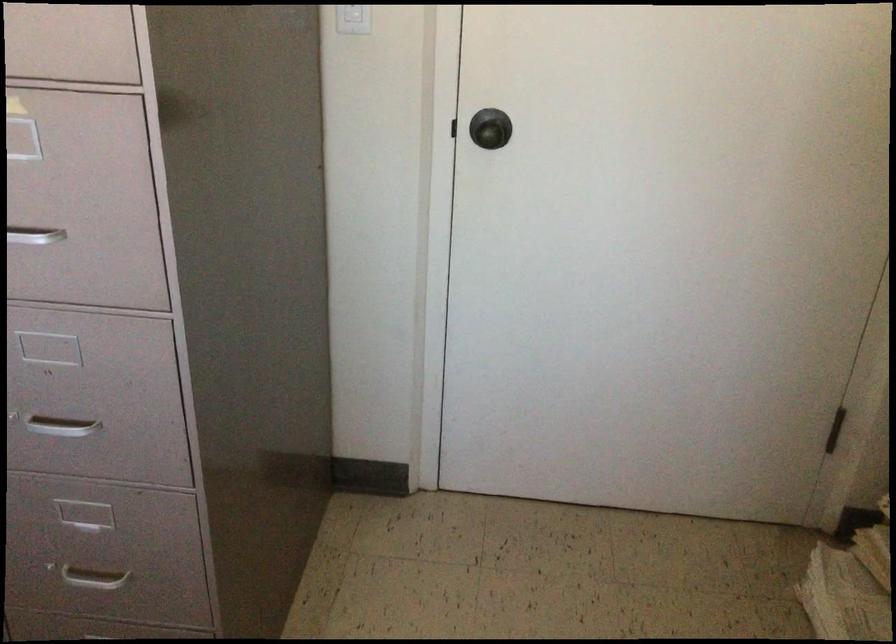
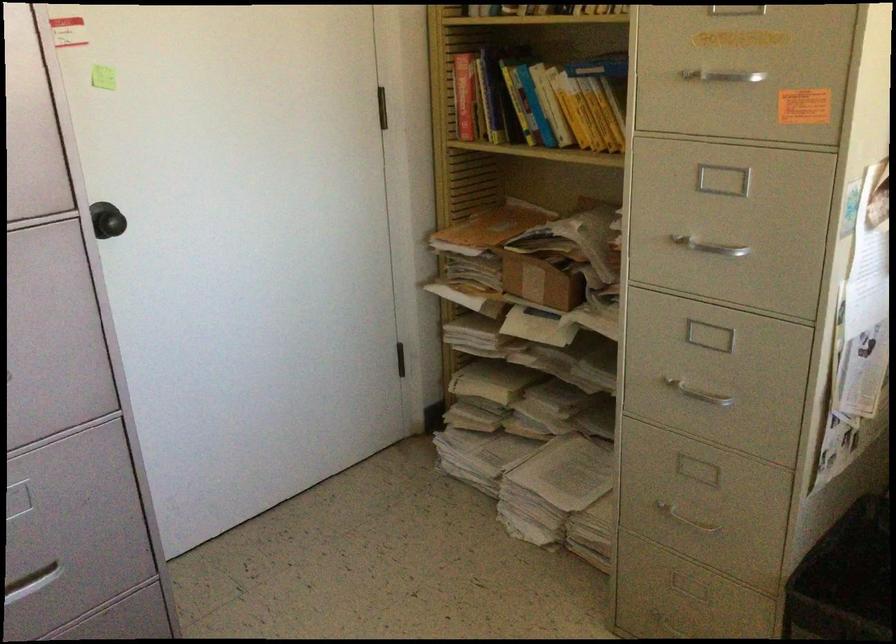
Locate, in the second image, the point that corresponds to (x=495, y=138) in the first image.

(115, 223)